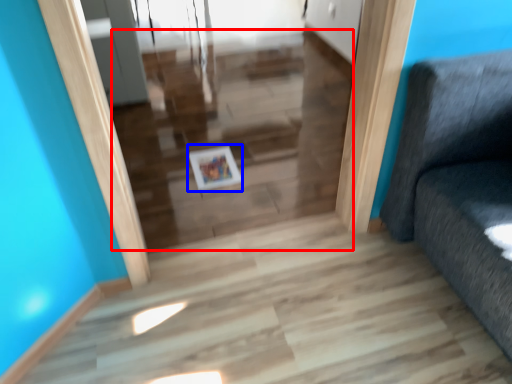
Question: Among these objects, which one is nearest to the camera, stairwell (highlighted by a red box) or picture frame (highlighted by a blue box)?

Choices:
 (A) stairwell
 (B) picture frame

Answer: (A)